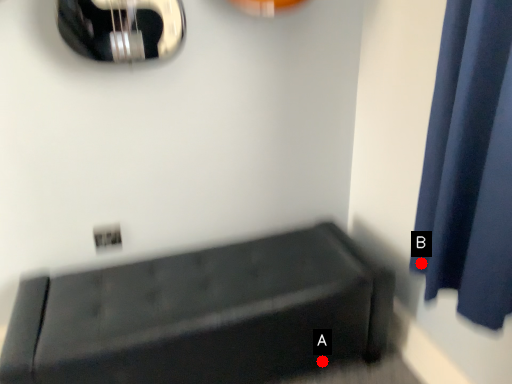
Question: Two points are circled on the image, labeled by A and B beside each circle. Which point is further to the camera?

Choices:
 (A) A is further
 (B) B is further

Answer: (A)